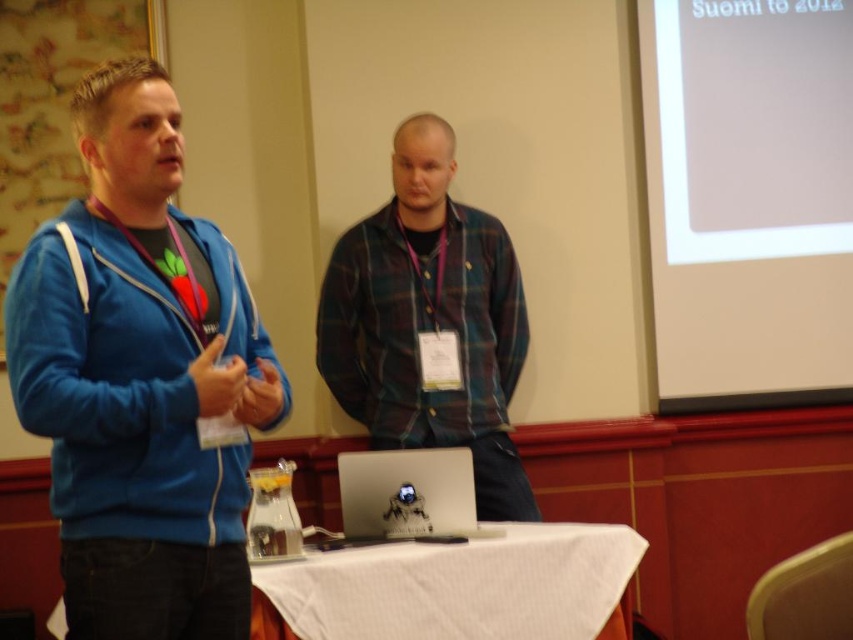
Between point (769, 252) and point (461, 506), which one is positioned behind?

The point (769, 252) is more distant.

Between white matte projection screen at upper right and silver metallic laptop at center, which one is positioned lower?

Positioned lower is silver metallic laptop at center.

Is point (786, 305) in front of point (428, 522)?

That is False.

This screenshot has width=853, height=640. What are the coordinates of `white matte projection screen at upper right` in the screenshot? It's located at (749, 198).

How distant is white cloth at lower center from silver metallic laptop at center?

7.05 inches

Does white cloth at lower center have a smaller size compared to silver metallic laptop at center?

Incorrect, white cloth at lower center is not smaller in size than silver metallic laptop at center.

Is point (396, 605) positioned before point (454, 461)?

Yes, point (396, 605) is closer to viewer.

This screenshot has height=640, width=853. Identify the location of white cloth at lower center. (460, 586).

The width and height of the screenshot is (853, 640). What do you see at coordinates (428, 321) in the screenshot? I see `plaid fabric shirt at center` at bounding box center [428, 321].

Is plaid fabric shirt at center further to the viewer compared to white cloth at lower center?

Yes, plaid fabric shirt at center is further from the viewer.

Does point (326, 305) come closer to viewer compared to point (376, 557)?

No.

You are a GUI agent. You are given a task and a screenshot of the screen. Output one action in this format:
    pyautogui.click(x=<x>, y=<y>)
    Task: Click on the plaid fabric shirt at center
    This screenshot has width=853, height=640.
    Given the screenshot: What is the action you would take?
    pyautogui.click(x=428, y=321)